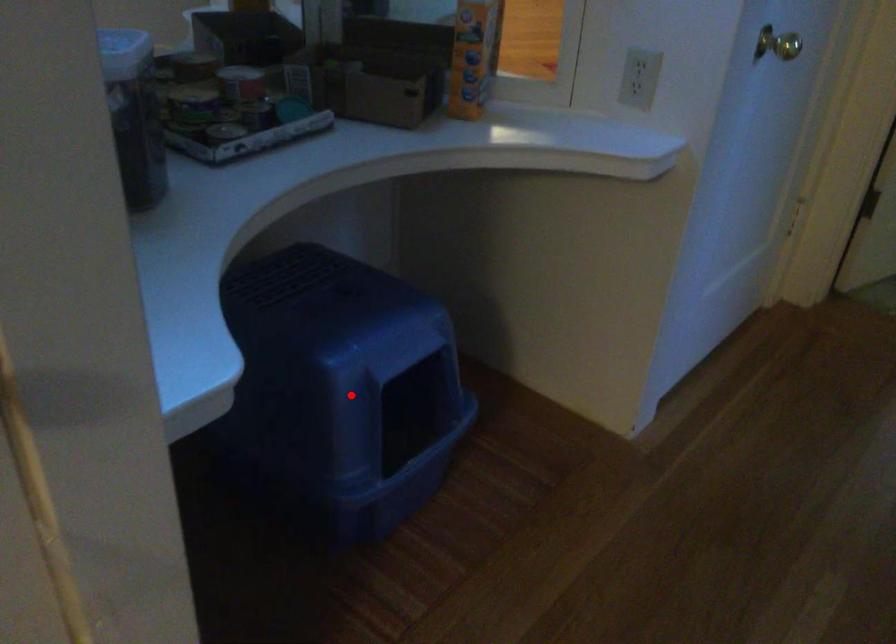
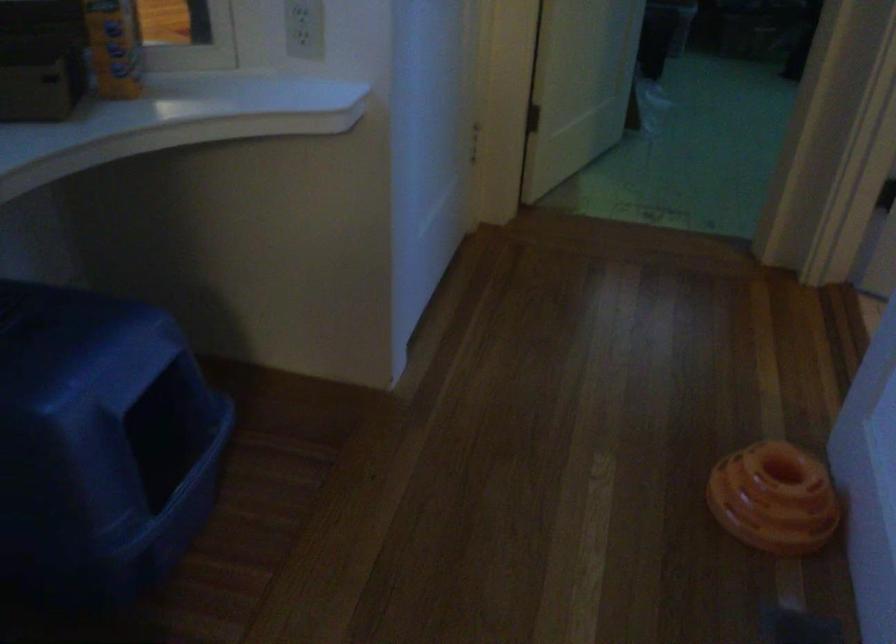
Find the pixel in the second image that matches the highlighted location in the first image.

(99, 442)